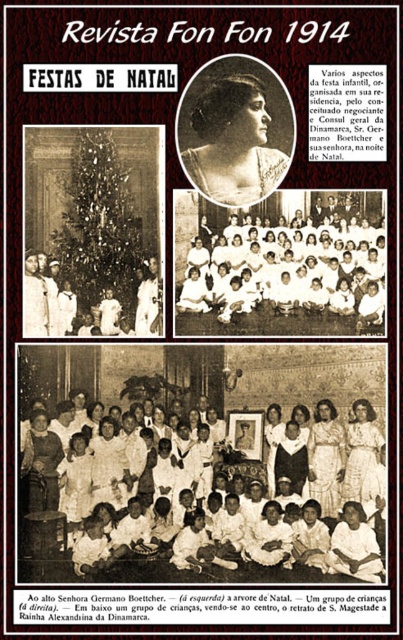
Which of these two, white satin dress at center or black satin dress at center, stands shorter?

With less height is black satin dress at center.

Looking at this image, who is positioned more to the right, white satin dress at center or black satin dress at center?

From the viewer's perspective, white satin dress at center appears more on the right side.

The height and width of the screenshot is (640, 403). Find the location of `white satin dress at center`. white satin dress at center is located at coordinates (324, 460).

Between white satin dress at center and white lace dress at center, which one is positioned lower?

white satin dress at center is lower down.

From the picture: Can you confirm if white satin dress at center is taller than white lace dress at center?

Yes, white satin dress at center is taller than white lace dress at center.

Is point (315, 484) in front of point (361, 497)?

No, it is not.

In order to click on white satin dress at center in this screenshot , I will do tap(324, 460).

Does matte black portrait at upper center have a greater width compared to white satin dress at center?

Indeed, matte black portrait at upper center has a greater width compared to white satin dress at center.

Is matte black portrait at upper center taller than white satin dress at center?

Yes, matte black portrait at upper center is taller than white satin dress at center.

Locate an element on the screen. matte black portrait at upper center is located at coordinates (234, 144).

Where is `matte black portrait at upper center`? Image resolution: width=403 pixels, height=640 pixels. matte black portrait at upper center is located at coordinates (234, 144).